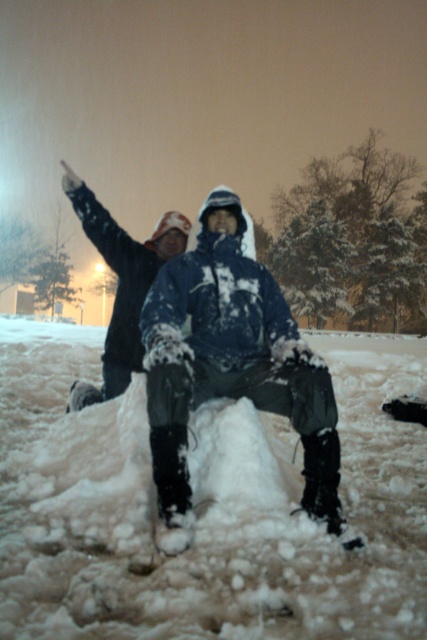
Looking at this image, you are planning to build a snowman using the white fluffy snow at center and the dark blue jacket at center. Which object can you use to build the snowman?

The white fluffy snow at center can be used to build the snowman since it is made of snow, while the dark blue jacket at center is a clothing item and cannot be used for building a snowman.

You are planning to build a snowman using the white fluffy snow at center and the dark blue jacket at center. Which object should you use for the base of the snowman and why?

The white fluffy snow at center should be used for the base of the snowman because it is bigger than the dark blue jacket at center, making it more suitable for the larger bottom part.

Based on the scene description, can you determine if the white fluffy snow at center is wider than the dark blue jacket at center?

The white fluffy snow at center is wider than the dark blue jacket at center according to the provided description.